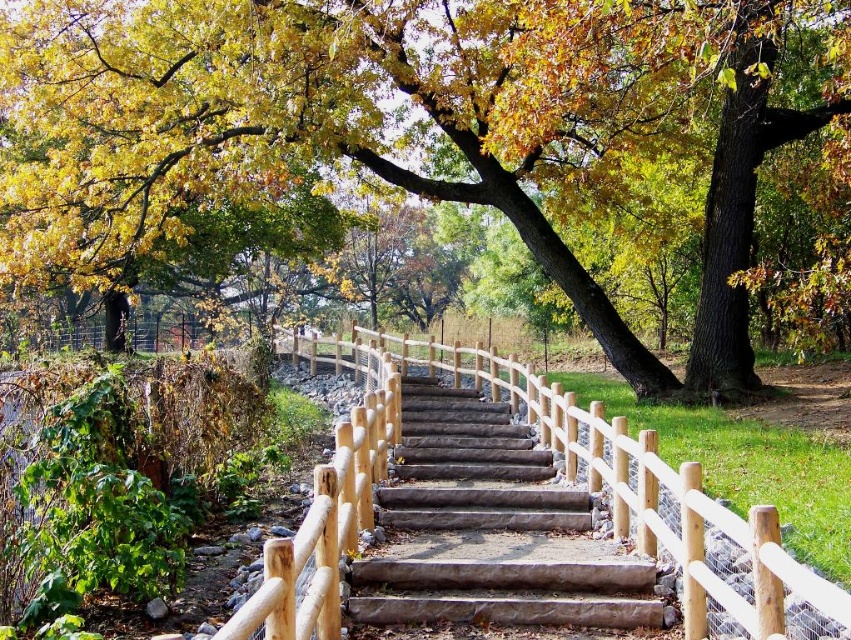
Which is above, natural wood rail at center or brown wood stairs at center?

natural wood rail at center is higher up.

Does point (844, 608) come behind point (381, 524)?

That is False.

Image resolution: width=851 pixels, height=640 pixels. I want to click on natural wood rail at center, so click(566, 477).